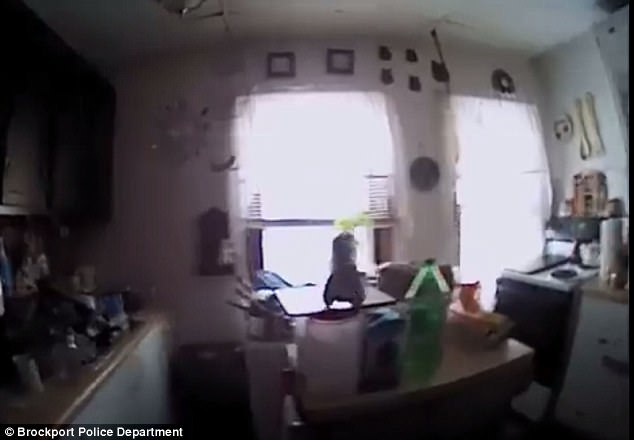
I want to click on spoons, so click(581, 126), click(595, 126).